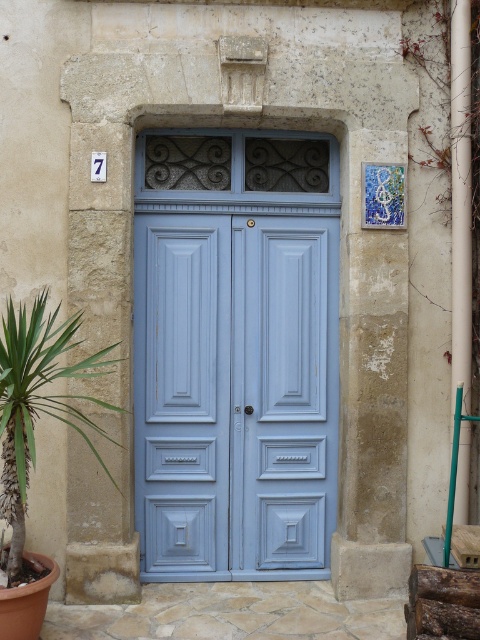
Who is more forward, (137, 428) or (73, 330)?

Point (73, 330) is more forward.

Who is positioned more to the left, light blue wood door at center or green leafy plant at lower left?

green leafy plant at lower left

Is point (264, 448) positioned behind point (38, 385)?

Yes, it is.

The height and width of the screenshot is (640, 480). I want to click on light blue wood door at center, so click(235, 394).